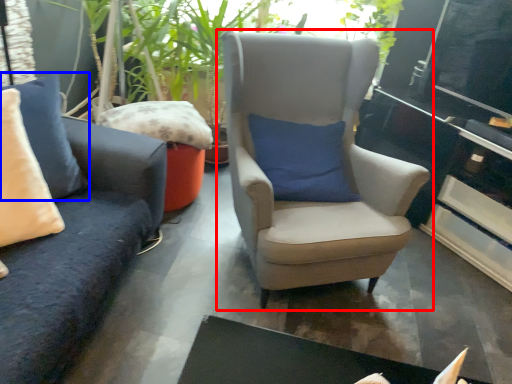
Question: Which object is further to the camera taking this photo, chair (highlighted by a red box) or pillow (highlighted by a blue box)?

Choices:
 (A) chair
 (B) pillow

Answer: (A)